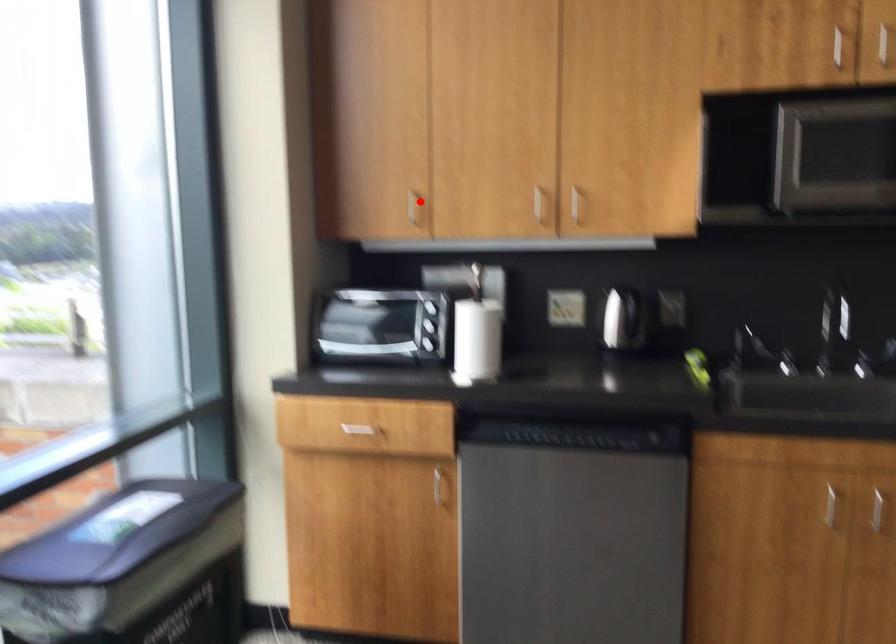
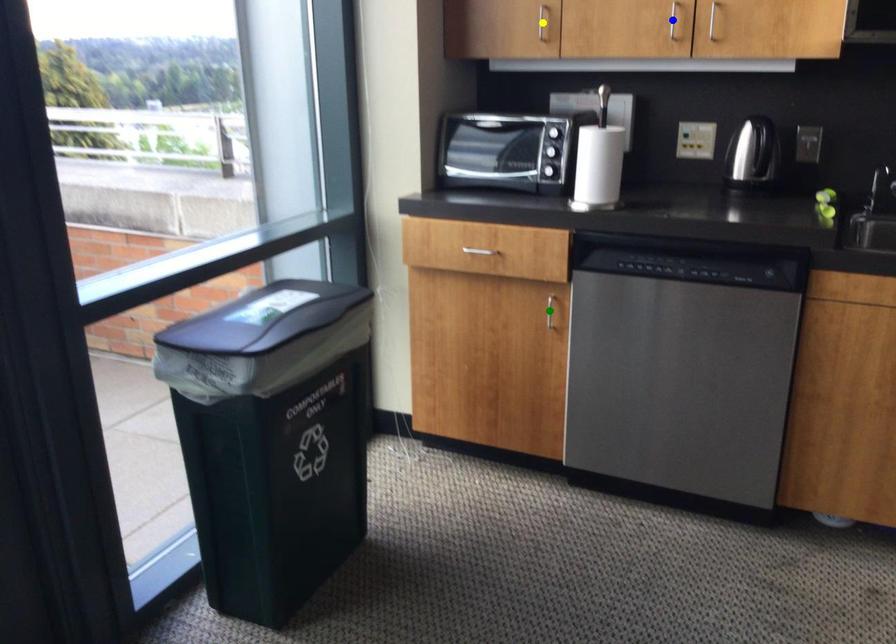
Question: I am providing you with two images of the same scene from different viewpoints. A red point is marked on the first image. You are given multiple points on the second image. Which point in image 2 represents the same 3d spot as the red point in image 1?

Choices:
 (A) green point
 (B) blue point
 (C) yellow point

Answer: (C)